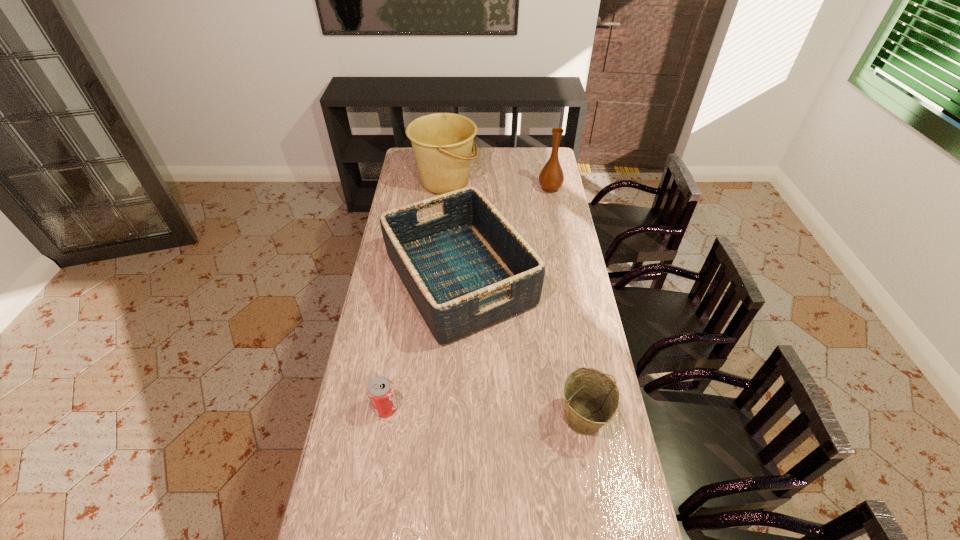
Locate an element on the screen. object positioned at the far edge is located at coordinates (442, 143).

I want to click on bucket that is positioned at the left edge, so click(442, 143).

I want to click on basket present at the left edge, so click(466, 268).

Identify the location of soda can situated at the left edge. The image size is (960, 540). (381, 393).

Where is `vase at the right edge`? This screenshot has width=960, height=540. vase at the right edge is located at coordinates (551, 177).

Find the location of a particular element. This screenshot has width=960, height=540. wine bucket positioned at the right edge is located at coordinates (591, 398).

Locate an element on the screen. The width and height of the screenshot is (960, 540). object present at the far left corner is located at coordinates (442, 143).

This screenshot has height=540, width=960. Identify the location of vacant space at the far edge of the desktop. (488, 150).

Locate an element on the screen. The width and height of the screenshot is (960, 540). vacant space at the left edge of the desktop is located at coordinates (384, 289).

In the image, there is a desktop. Identify the location of vacant space at the right edge. (594, 433).